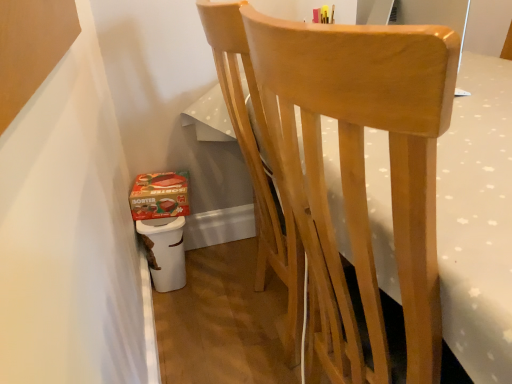
Question: Is white plastic potty at lower left spatially inside matte cardboard box at lower left, or outside of it?

Choices:
 (A) inside
 (B) outside

Answer: (B)

Question: From the image's perspective, is white plastic potty at lower left above or below matte cardboard box at lower left?

Choices:
 (A) above
 (B) below

Answer: (B)

Question: Estimate the real-world distances between objects in this image. Which object is farther from the natural wood chair at center?

Choices:
 (A) white plastic potty at lower left
 (B) matte cardboard box at lower left

Answer: (B)

Question: Which object is positioned closest to the white plastic potty at lower left?

Choices:
 (A) matte cardboard box at lower left
 (B) natural wood chair at center

Answer: (A)